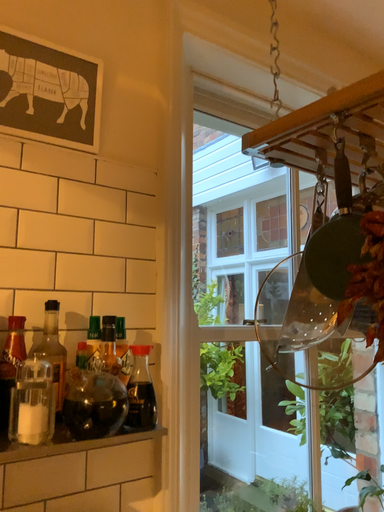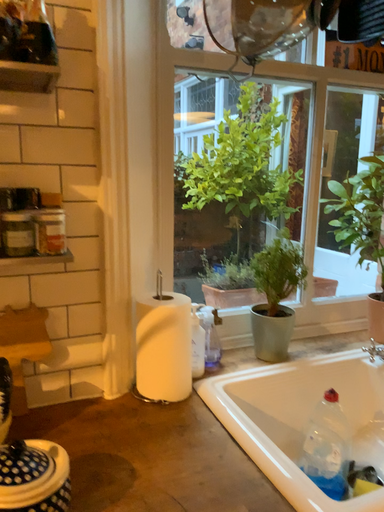
Question: How did the camera likely rotate when shooting the video?

Choices:
 (A) rotated left
 (B) rotated right

Answer: (A)